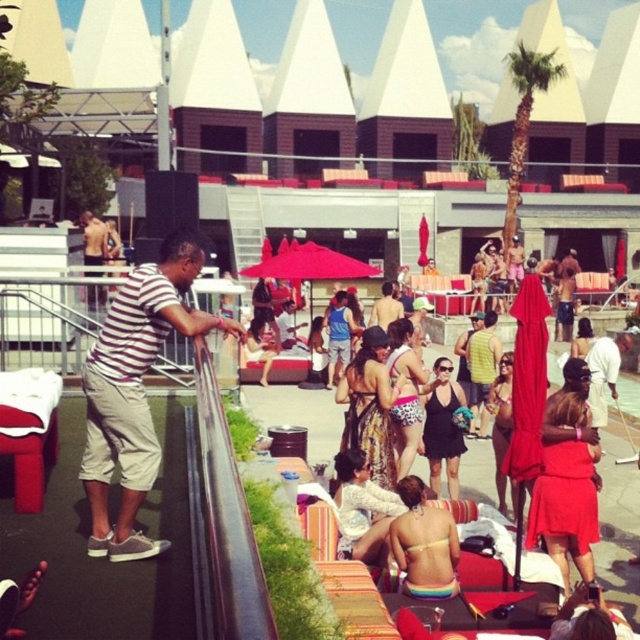
You are standing at the edge of the pool area and want to hand a towel to the person wearing the striped cotton shirt at left. If you can throw a towel up to 5 meters, will you be able to reach them?

The striped cotton shirt at left and the viewer are 5.37 meters apart. Since the maximum throwing distance is 5 meters, you cannot reach them by throwing the towel.

You are a photographer at the poolside and want to capture both the rainbow bikini at center and the striped cotton shirt at center in a single shot. Which object would appear narrower in the photo?

The rainbow bikini at center is thinner than the striped cotton shirt at center, so it would appear narrower in the photo.